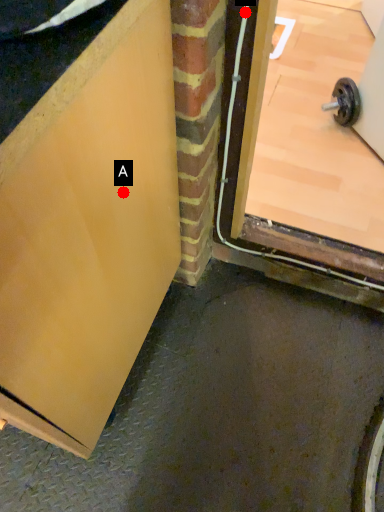
Question: Two points are circled on the image, labeled by A and B beside each circle. Which point is closer to the camera?

Choices:
 (A) A is closer
 (B) B is closer

Answer: (A)